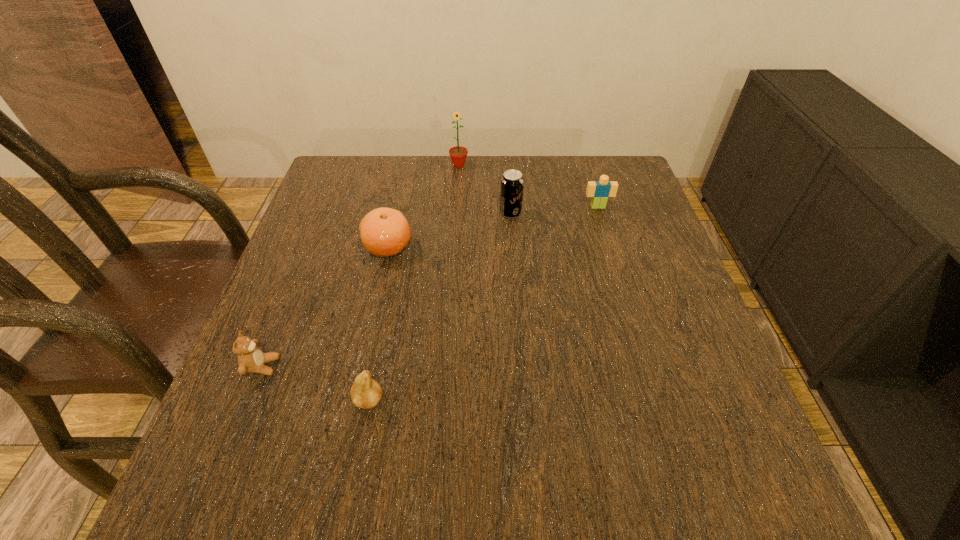
The image size is (960, 540). What are the coordinates of `vacant area situated on the front of the fifth object from left to right` in the screenshot? It's located at (519, 321).

Image resolution: width=960 pixels, height=540 pixels. In order to click on vacant space located 0.210m on the right of the fourth farthest object in this screenshot , I will do `click(502, 247)`.

Identify the location of free location located 0.370m on the face of the rightmost object. (634, 323).

In order to click on free point located on the back of the pear in this screenshot , I will do `click(399, 241)`.

Identify the location of free spot located 0.180m on the front-facing side of the fifth farthest object. This screenshot has width=960, height=540. (376, 366).

Locate an element on the screen. The image size is (960, 540). sunflower at the far edge is located at coordinates (458, 154).

Locate an element on the screen. This screenshot has height=540, width=960. Lego that is positioned at the far edge is located at coordinates (600, 190).

This screenshot has width=960, height=540. Find the location of `clementine that is at the left edge`. clementine that is at the left edge is located at coordinates (384, 231).

Where is `teddy bear located at the left edge`? This screenshot has width=960, height=540. teddy bear located at the left edge is located at coordinates (251, 359).

Identify the location of object that is at the right edge. This screenshot has height=540, width=960. (600, 190).